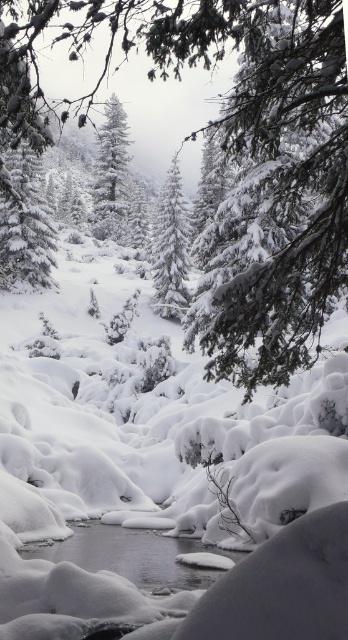
Question: Is white snow-covered tree at center thinner than snow-covered evergreen tree at center?

Choices:
 (A) no
 (B) yes

Answer: (B)

Question: Estimate the real-world distances between objects in this image. Which object is farther from the clear ice stream at center?

Choices:
 (A) white snow-covered tree at center
 (B) green textured pine branch at upper right

Answer: (A)

Question: Which point is farther to the camera?

Choices:
 (A) (51, 552)
 (B) (107, 172)
 (C) (327, 275)

Answer: (B)

Question: Does white snow-covered tree at center lie behind snow-covered evergreen tree at center?

Choices:
 (A) yes
 (B) no

Answer: (B)

Question: Can you confirm if green textured pine branch at upper right is positioned above snow-covered evergreen tree at center?

Choices:
 (A) no
 (B) yes

Answer: (A)

Question: Considering the real-world distances, which object is farthest from the snow-covered evergreen tree at center?

Choices:
 (A) white snow-covered tree at center
 (B) green textured pine branch at upper right
 (C) clear ice stream at center

Answer: (C)